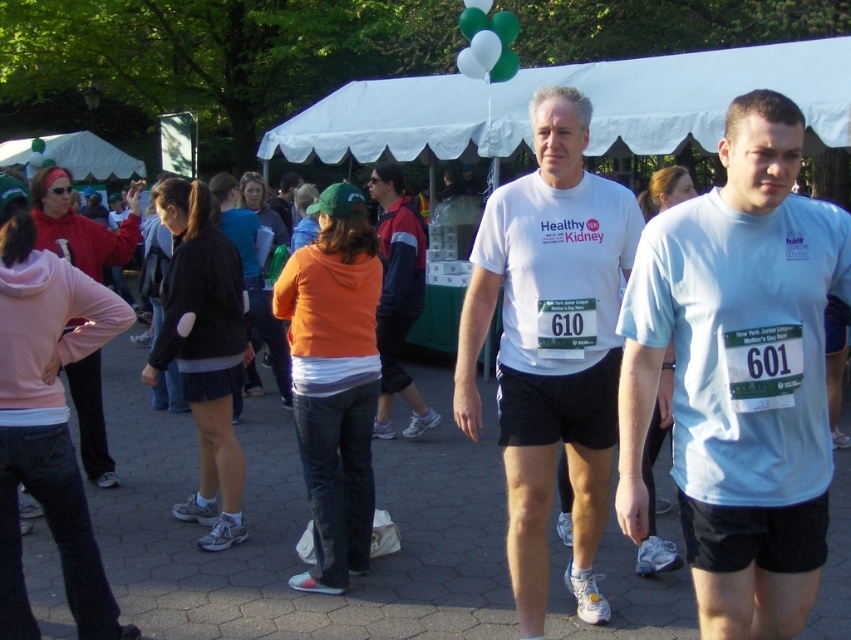
From the picture: You are a photographer at the event and want to capture both the orange fleece at center and the orange fabric jacket at center in the same frame. Which object should you position closer to the left side of your camera viewfinder to include both?

To include both the orange fleece at center and the orange fabric jacket at center in the same frame, position the orange fleece at center closer to the left side of your camera viewfinder since it is already to the left of the orange fabric jacket at center.